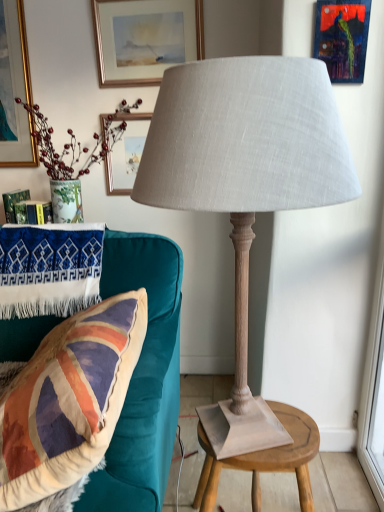
Where is `transparent glass window screen at right`? transparent glass window screen at right is located at coordinates (374, 397).

I want to click on velvet union jack pillow at left, so click(x=69, y=399).

From a real-world perspective, is wooden stool at center under matte gold picture frame at upper center, marked as the 2th picture frame in a right-to-left arrangement?

Indeed, from a real-world perspective, wooden stool at center is positioned beneath matte gold picture frame at upper center, marked as the 2th picture frame in a right-to-left arrangement.

Consider the image. Would you say wooden stool at center is a long distance from matte gold picture frame at upper center, placed as the 2th picture frame when sorted from front to back?

Indeed, wooden stool at center is not near matte gold picture frame at upper center, placed as the 2th picture frame when sorted from front to back.

Consider the image. From the image's perspective, is wooden stool at center positioned above or below matte gold picture frame at upper center, which is counted as the first picture frame, starting from the top?

Clearly, from the image's perspective, wooden stool at center is below matte gold picture frame at upper center, which is counted as the first picture frame, starting from the top.

Considering the positions of objects wooden stool at center and matte gold picture frame at upper center, the 1th picture frame when ordered from back to front, in the image provided, who is behind, wooden stool at center or matte gold picture frame at upper center, the 1th picture frame when ordered from back to front,?

matte gold picture frame at upper center, the 1th picture frame when ordered from back to front, is further from the camera.

From the image's perspective, between wooden stool at center and velvet union jack pillow at left, which one is located above?

velvet union jack pillow at left is shown above in the image.

Looking at this image, does wooden stool at center have a lesser width compared to velvet union jack pillow at left?

Indeed, wooden stool at center has a lesser width compared to velvet union jack pillow at left.

Would you say wooden stool at center is a long distance from velvet union jack pillow at left?

No, wooden stool at center is not far away from velvet union jack pillow at left.

Considering the relative positions of wooden stool at center and velvet union jack pillow at left in the image provided, is wooden stool at center behind velvet union jack pillow at left?

Yes, wooden stool at center is further from the camera.

Considering the positions of objects transparent glass window screen at right and wooden stool at center in the image provided, who is behind, transparent glass window screen at right or wooden stool at center?

transparent glass window screen at right.

Is transparent glass window screen at right placed right next to wooden stool at center?

transparent glass window screen at right and wooden stool at center are not in contact.

From a real-world perspective, is transparent glass window screen at right beneath wooden stool at center?

No, from a real-world perspective, transparent glass window screen at right is not below wooden stool at center.

Between matte gray fabric lamp at center and wooden stool at center, which one appears on the left side from the viewer's perspective?

From the viewer's perspective, matte gray fabric lamp at center appears more on the left side.

In terms of width, does matte gray fabric lamp at center look wider or thinner when compared to wooden stool at center?

Clearly, matte gray fabric lamp at center has more width compared to wooden stool at center.

Looking at this image, from the image's perspective, would you say matte gray fabric lamp at center is shown under wooden stool at center?

No, from the image's perspective, matte gray fabric lamp at center is not beneath wooden stool at center.

Between matte gray fabric lamp at center and wooden stool at center, which one is positioned behind?

wooden stool at center is further from the camera.

Between matte gold picture frame at upper center, arranged as the 1th picture frame when viewed from the left, and matte gray fabric lamp at center, which one is positioned behind?

Positioned behind is matte gold picture frame at upper center, arranged as the 1th picture frame when viewed from the left.

Which of these two, matte gold picture frame at upper center, placed as the 2th picture frame when sorted from front to back, or matte gray fabric lamp at center, is thinner?

With smaller width is matte gold picture frame at upper center, placed as the 2th picture frame when sorted from front to back.

Is matte gold picture frame at upper center, marked as the 2th picture frame in a right-to-left arrangement, next to matte gray fabric lamp at center?

matte gold picture frame at upper center, marked as the 2th picture frame in a right-to-left arrangement, is not next to matte gray fabric lamp at center, and they're not touching.

From the image's perspective, who appears lower, matte gold picture frame at upper center, placed as the 2th picture frame when sorted from front to back, or matte gray fabric lamp at center?

matte gray fabric lamp at center, from the image's perspective.

What's the angular difference between matte gray fabric lamp at center and transparent glass window screen at right's facing directions?

The angle between the facing direction of matte gray fabric lamp at center and the facing direction of transparent glass window screen at right is 1.86 degrees.

This screenshot has height=512, width=384. Identify the location of lamp on the left of transparent glass window screen at right. (245, 155).

From the image's perspective, is matte gray fabric lamp at center on top of transparent glass window screen at right?

Yes.

In the scene shown: Which is behind, matte gray fabric lamp at center or transparent glass window screen at right?

transparent glass window screen at right is more distant.

Looking at their sizes, would you say matte gray fabric lamp at center is wider or thinner than velvet union jack pillow at left?

In the image, matte gray fabric lamp at center appears to be more narrow than velvet union jack pillow at left.

Which is behind, point (350, 193) or point (40, 476)?

Positioned behind is point (40, 476).

In the scene shown: Would you say velvet union jack pillow at left is part of matte gray fabric lamp at center's contents?

Definitely not — velvet union jack pillow at left is not inside matte gray fabric lamp at center.

Is matte gray fabric lamp at center aimed at velvet union jack pillow at left?

Yes, matte gray fabric lamp at center is facing velvet union jack pillow at left.

I want to click on table below the matte gold picture frame at upper center, placed as the 2th picture frame when sorted from front to back (from the image's perspective), so click(264, 460).

This screenshot has height=512, width=384. I want to click on pillow above the wooden stool at center (from a real-world perspective), so click(x=69, y=399).

When comparing their distances from matte gold picture frame at upper center, the 1th picture frame when ordered from back to front, does transparent glass window screen at right or velvet union jack pillow at left seem closer?

Among the two, velvet union jack pillow at left is located nearer to matte gold picture frame at upper center, the 1th picture frame when ordered from back to front.

Estimate the real-world distances between objects in this image. Which object is further from transparent glass window screen at right, wooden stool at center or matte gold picture frame at upper center, arranged as the 1th picture frame when viewed from the left?

matte gold picture frame at upper center, arranged as the 1th picture frame when viewed from the left, is further to transparent glass window screen at right.

Estimate the real-world distances between objects in this image. Which object is closer to matte gold picture frame at upper center, arranged as the 1th picture frame when viewed from the left, matte gray fabric lamp at center or velvet union jack pillow at left?

matte gray fabric lamp at center lies closer to matte gold picture frame at upper center, arranged as the 1th picture frame when viewed from the left, than the other object.

Looking at this image, from the image, which object appears to be nearer to matte gray fabric lamp at center, metallic blue painting at upper right, which is counted as the 2th picture frame, starting from the left, or velvet union jack pillow at left?

Based on the image, velvet union jack pillow at left appears to be nearer to matte gray fabric lamp at center.

Consider the image. When comparing their distances from matte gray fabric lamp at center, does wooden stool at center or transparent glass window screen at right seem closer?

wooden stool at center is closer to matte gray fabric lamp at center.

Based on their spatial positions, is matte gray fabric lamp at center or metallic blue painting at upper right, which ranks as the first picture frame in right-to-left order, further from transparent glass window screen at right?

matte gray fabric lamp at center lies further to transparent glass window screen at right than the other object.

From the image, which object appears to be farther from transparent glass window screen at right, wooden stool at center or matte gray fabric lamp at center?

matte gray fabric lamp at center is positioned further to the anchor transparent glass window screen at right.

Based on their spatial positions, is matte gold picture frame at upper center, the 1th picture frame when ordered from back to front, or wooden stool at center closer to velvet union jack pillow at left?

wooden stool at center.

Where is `lamp between matte gold picture frame at upper center, marked as the 2th picture frame in a right-to-left arrangement, and transparent glass window screen at right, in the vertical direction`? lamp between matte gold picture frame at upper center, marked as the 2th picture frame in a right-to-left arrangement, and transparent glass window screen at right, in the vertical direction is located at coordinates (245, 155).

Where is `lamp that lies between metallic blue painting at upper right, the 1th picture frame positioned from the front, and wooden stool at center from top to bottom`? Image resolution: width=384 pixels, height=512 pixels. lamp that lies between metallic blue painting at upper right, the 1th picture frame positioned from the front, and wooden stool at center from top to bottom is located at coordinates (245, 155).

I want to click on table between velvet union jack pillow at left and transparent glass window screen at right from left to right, so click(264, 460).

At what (x,y) coordinates should I click in order to perform the action: click on picture frame located between matte gray fabric lamp at center and matte gold picture frame at upper center, which is counted as the first picture frame, starting from the top, in the depth direction. Please return your answer as a coordinate pair (x, y). Looking at the image, I should click on (342, 38).